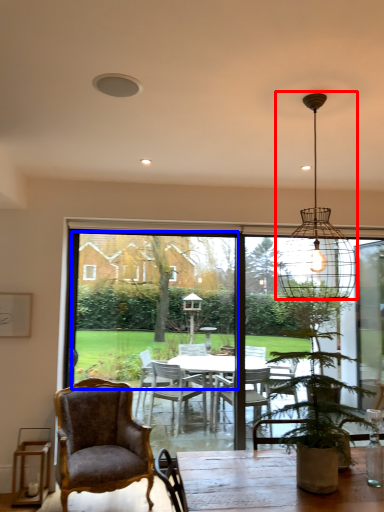
Question: Which object appears closest to the camera in this image, light fixture (highlighted by a red box) or window screen (highlighted by a blue box)?

Choices:
 (A) light fixture
 (B) window screen

Answer: (A)